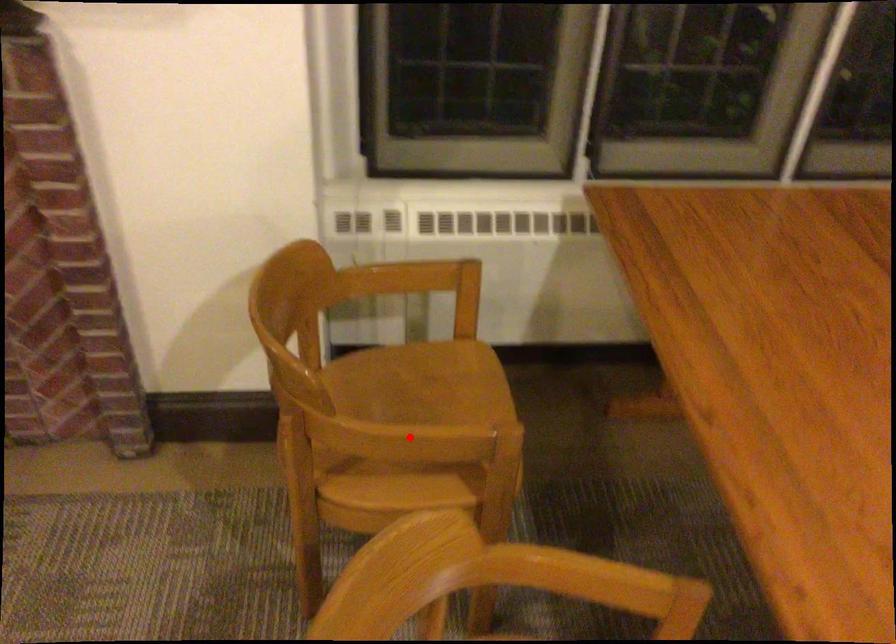
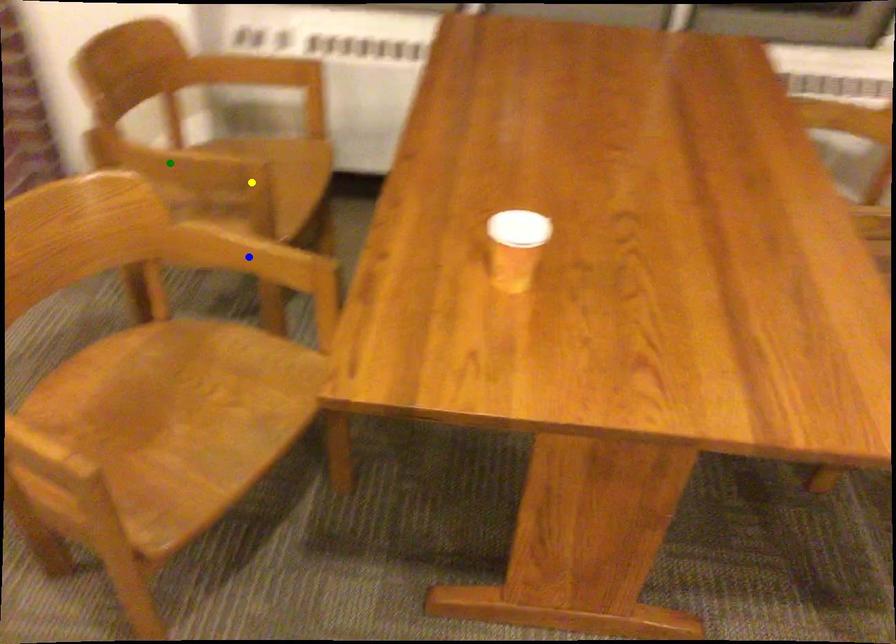
Question: I am providing you with two images of the same scene from different viewpoints. A red point is marked on the first image. You are given multiple points on the second image. Can you choose the point in image 2 that corresponds to the point in image 1?

Choices:
 (A) green point
 (B) blue point
 (C) yellow point

Answer: (A)